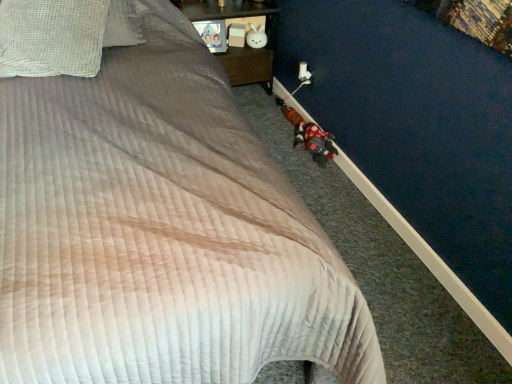
Question: From a real-world perspective, is white matte plush rabbit at upper center, placed as the 2th toy when sorted from bottom to top, positioned under fluffy plush toy at lower right, marked as the first toy in a bottom-to-top arrangement, based on gravity?

Choices:
 (A) yes
 (B) no

Answer: (B)

Question: Would you say white matte plush rabbit at upper center, which is counted as the first toy, starting from the left, is outside fluffy plush toy at lower right, arranged as the second toy when viewed from the left?

Choices:
 (A) yes
 (B) no

Answer: (A)

Question: Is white matte plush rabbit at upper center, which appears as the 2th toy when viewed from the front, thinner than fluffy plush toy at lower right, the first toy viewed from the right?

Choices:
 (A) yes
 (B) no

Answer: (A)

Question: From a real-world perspective, is white matte plush rabbit at upper center, which is counted as the second toy, starting from the right, over fluffy plush toy at lower right, the 2th toy viewed from the top?

Choices:
 (A) yes
 (B) no

Answer: (A)

Question: Does white matte plush rabbit at upper center, which is counted as the second toy, starting from the right, have a greater width compared to fluffy plush toy at lower right, arranged as the second toy when viewed from the left?

Choices:
 (A) yes
 (B) no

Answer: (B)

Question: From a real-world perspective, relative to white matte plush rabbit at upper center, placed as the 2th toy when sorted from bottom to top, is white checkered pillow at upper left vertically above or below?

Choices:
 (A) below
 (B) above

Answer: (B)

Question: Considering their positions, is white checkered pillow at upper left located in front of or behind white matte plush rabbit at upper center, which appears as the 2th toy when viewed from the front?

Choices:
 (A) behind
 (B) front

Answer: (B)

Question: From the image's perspective, is white checkered pillow at upper left above or below white matte plush rabbit at upper center, placed as the 2th toy when sorted from bottom to top?

Choices:
 (A) below
 (B) above

Answer: (A)

Question: In the image, is white checkered pillow at upper left on the left side or the right side of white matte plush rabbit at upper center, which ranks as the 1th toy in back-to-front order?

Choices:
 (A) left
 (B) right

Answer: (A)

Question: From a real-world perspective, is fluffy plush toy at lower right, the first toy viewed from the right, physically located above or below white checkered pillow at upper left?

Choices:
 (A) below
 (B) above

Answer: (A)

Question: From the image's perspective, is fluffy plush toy at lower right, acting as the 2th toy starting from the back, positioned above or below white checkered pillow at upper left?

Choices:
 (A) below
 (B) above

Answer: (A)

Question: Considering the positions of fluffy plush toy at lower right, marked as the first toy in a bottom-to-top arrangement, and white checkered pillow at upper left in the image, is fluffy plush toy at lower right, marked as the first toy in a bottom-to-top arrangement, wider or thinner than white checkered pillow at upper left?

Choices:
 (A) wide
 (B) thin

Answer: (B)

Question: Which is correct: fluffy plush toy at lower right, marked as the first toy in a bottom-to-top arrangement, is inside white checkered pillow at upper left, or outside of it?

Choices:
 (A) inside
 (B) outside

Answer: (B)

Question: Is wooden nightstand at upper center taller or shorter than white checkered pillow at upper left?

Choices:
 (A) tall
 (B) short

Answer: (A)

Question: Based on their sizes in the image, would you say wooden nightstand at upper center is bigger or smaller than white checkered pillow at upper left?

Choices:
 (A) big
 (B) small

Answer: (A)